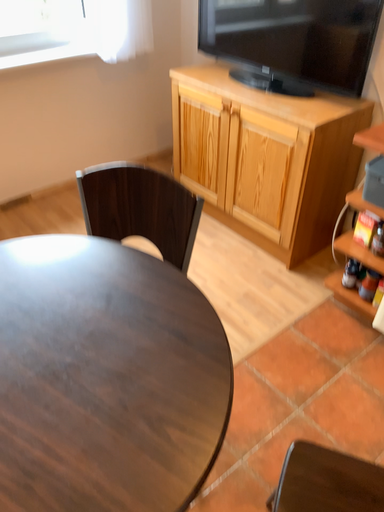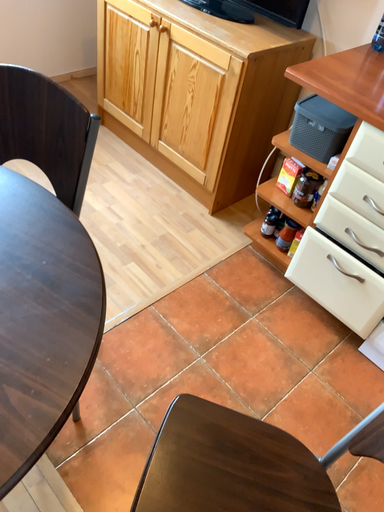
Question: Which way did the camera rotate in the video?

Choices:
 (A) rotated downward
 (B) rotated upward

Answer: (A)